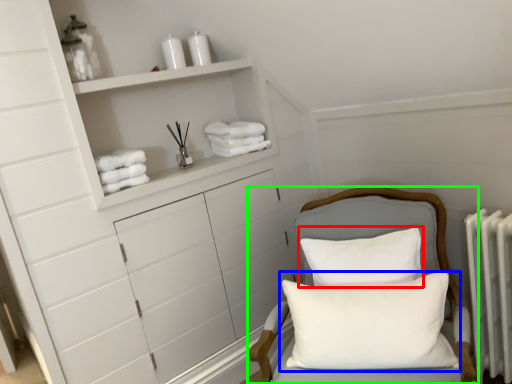
Question: Which object is positioned farthest from pillow (highlighted by a red box)? Select from pillow (highlighted by a blue box) and furniture (highlighted by a green box).

Choices:
 (A) pillow
 (B) furniture

Answer: (B)